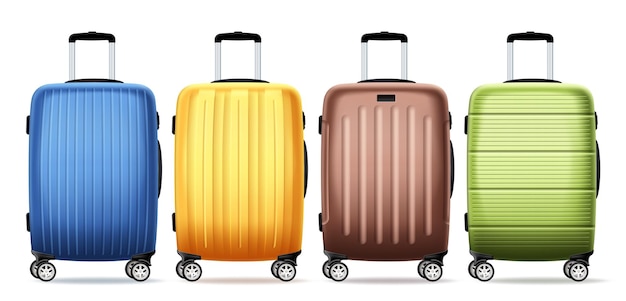
The height and width of the screenshot is (301, 626). Identify the location of handle. (86, 32), (233, 34), (382, 34), (536, 34).